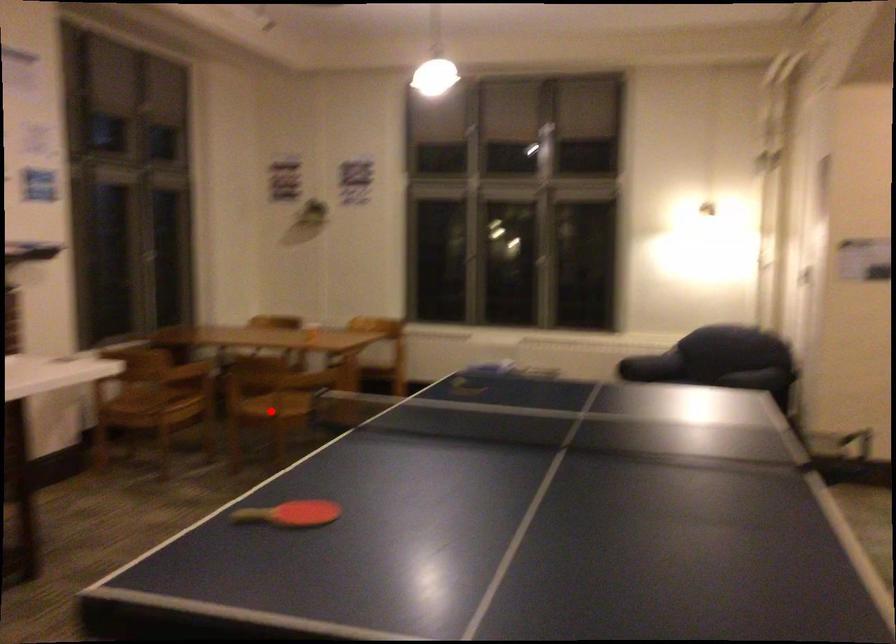
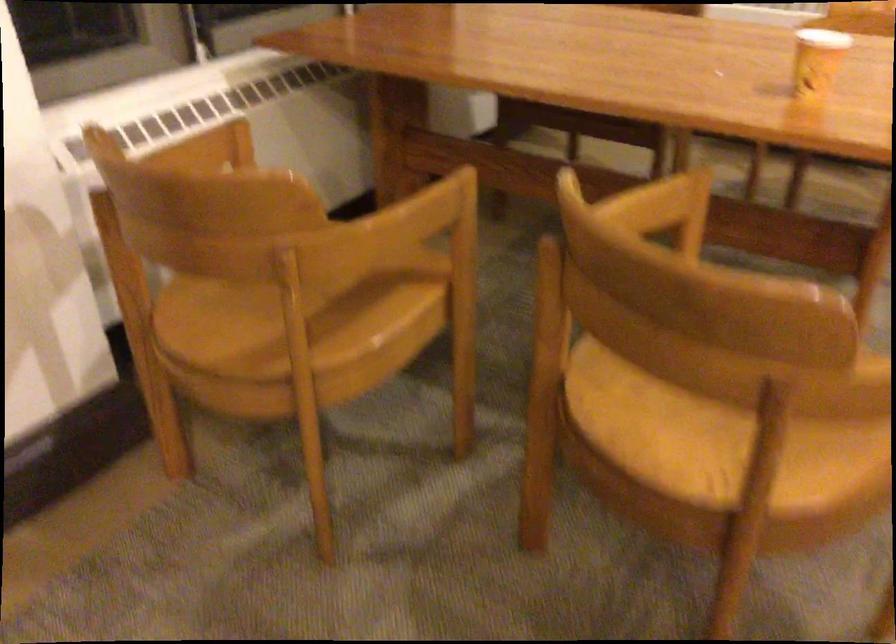
Question: A red point is marked in image1. In image2, is the corresponding 3D point closer to the camera or farther? Reply with the corresponding letter.

Choices:
 (A) The corresponding 3D point is closer.
 (B) The corresponding 3D point is farther.

Answer: (A)